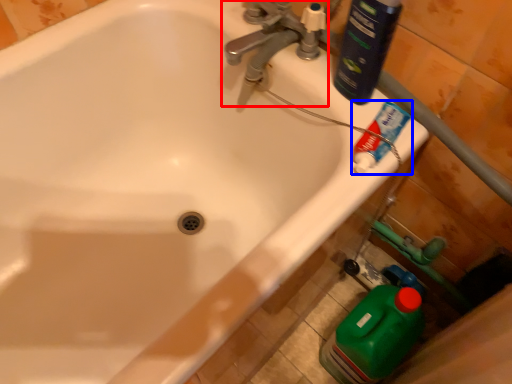
Question: Which object appears farthest to the camera in this image, tap (highlighted by a red box) or toothpaste (highlighted by a blue box)?

Choices:
 (A) tap
 (B) toothpaste

Answer: (A)